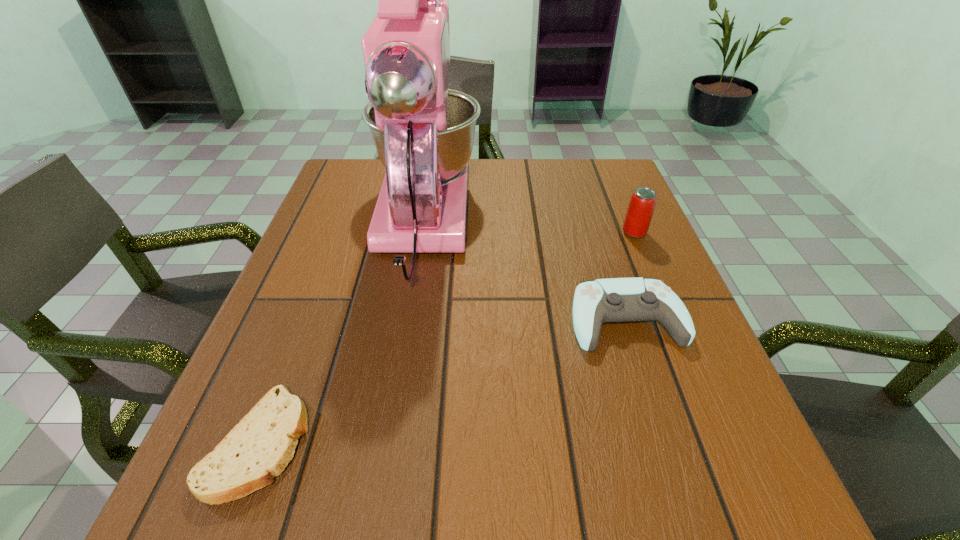
Locate an element on the screen. Image resolution: width=960 pixels, height=540 pixels. free space between the third tallest object and the beer can is located at coordinates (630, 276).

What are the coordinates of `object that is the closest one to the nearest object` in the screenshot? It's located at click(x=423, y=132).

The image size is (960, 540). Find the location of `object that is the third nearest to the third shortest object`. object that is the third nearest to the third shortest object is located at coordinates (261, 445).

Find the location of a particular element. vacant area that satisfies the following two spatial constraints: 1. on the back side of the pita bread; 2. on the left side of the beer can is located at coordinates (339, 233).

Locate an element on the screen. The image size is (960, 540). vacant space that satisfies the following two spatial constraints: 1. on the back side of the beer can; 2. on the right side of the control is located at coordinates (598, 233).